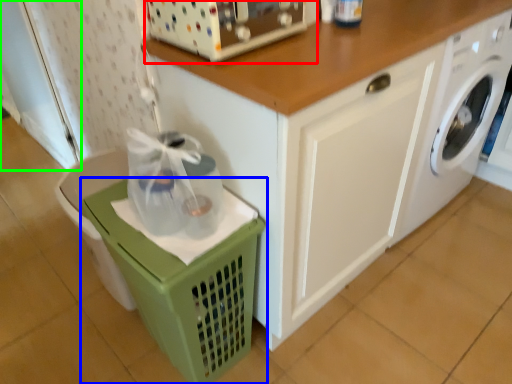
Question: Estimate the real-world distances between objects in this image. Which object is farther from appliance (highlighted by a red box), basket (highlighted by a blue box) or screen door (highlighted by a green box)?

Choices:
 (A) basket
 (B) screen door

Answer: (B)